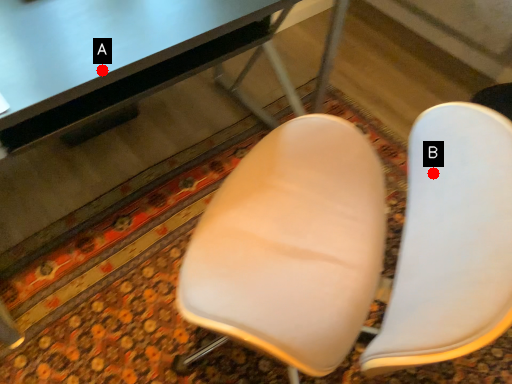
Question: Two points are circled on the image, labeled by A and B beside each circle. Which point is closer to the camera?

Choices:
 (A) A is closer
 (B) B is closer

Answer: (B)